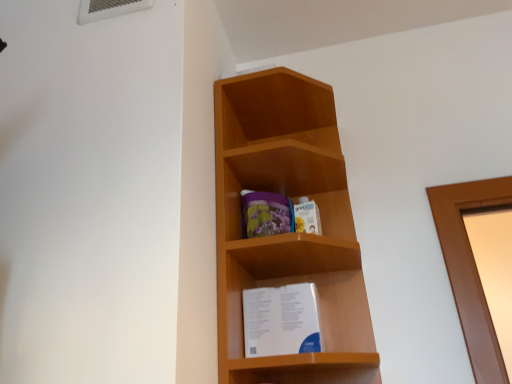
The height and width of the screenshot is (384, 512). In order to click on vacant area on top of light brown wood at center (from a real-world perspective) in this screenshot , I will do `click(276, 98)`.